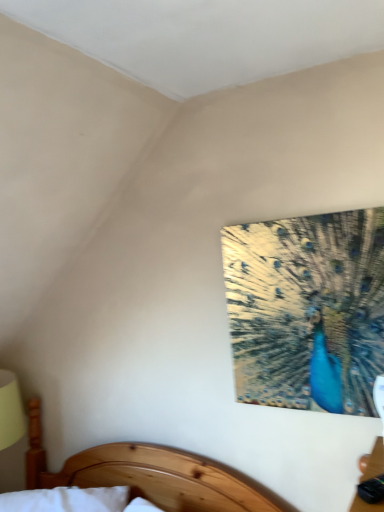
Question: Should I look upward or downward to see wooden bed at lower center?

Choices:
 (A) up
 (B) down

Answer: (B)

Question: Does shiny metallic peacock at upper right have a greater height compared to wooden bed at lower center?

Choices:
 (A) no
 (B) yes

Answer: (B)

Question: Is shiny metallic peacock at upper right behind wooden bed at lower center?

Choices:
 (A) no
 (B) yes

Answer: (B)

Question: Is shiny metallic peacock at upper right next to wooden bed at lower center and touching it?

Choices:
 (A) no
 (B) yes

Answer: (A)

Question: From the image's perspective, is shiny metallic peacock at upper right beneath wooden bed at lower center?

Choices:
 (A) no
 (B) yes

Answer: (A)

Question: Is shiny metallic peacock at upper right thinner than wooden bed at lower center?

Choices:
 (A) yes
 (B) no

Answer: (A)

Question: Can you confirm if shiny metallic peacock at upper right is positioned to the left of wooden bed at lower center?

Choices:
 (A) no
 (B) yes

Answer: (A)

Question: Would you say wooden bed at lower center is a long distance from shiny metallic peacock at upper right?

Choices:
 (A) yes
 (B) no

Answer: (B)

Question: From the image's perspective, is wooden bed at lower center below shiny metallic peacock at upper right?

Choices:
 (A) yes
 (B) no

Answer: (A)

Question: From the image's perspective, is wooden bed at lower center on shiny metallic peacock at upper right?

Choices:
 (A) yes
 (B) no

Answer: (B)

Question: From a real-world perspective, is wooden bed at lower center located higher than shiny metallic peacock at upper right?

Choices:
 (A) no
 (B) yes

Answer: (A)

Question: Is wooden bed at lower center located outside shiny metallic peacock at upper right?

Choices:
 (A) no
 (B) yes

Answer: (B)

Question: Is shiny metallic peacock at upper right inside wooden bed at lower center?

Choices:
 (A) yes
 (B) no

Answer: (B)

Question: In terms of width, does wooden bed at lower center look wider or thinner when compared to shiny metallic peacock at upper right?

Choices:
 (A) wide
 (B) thin

Answer: (A)